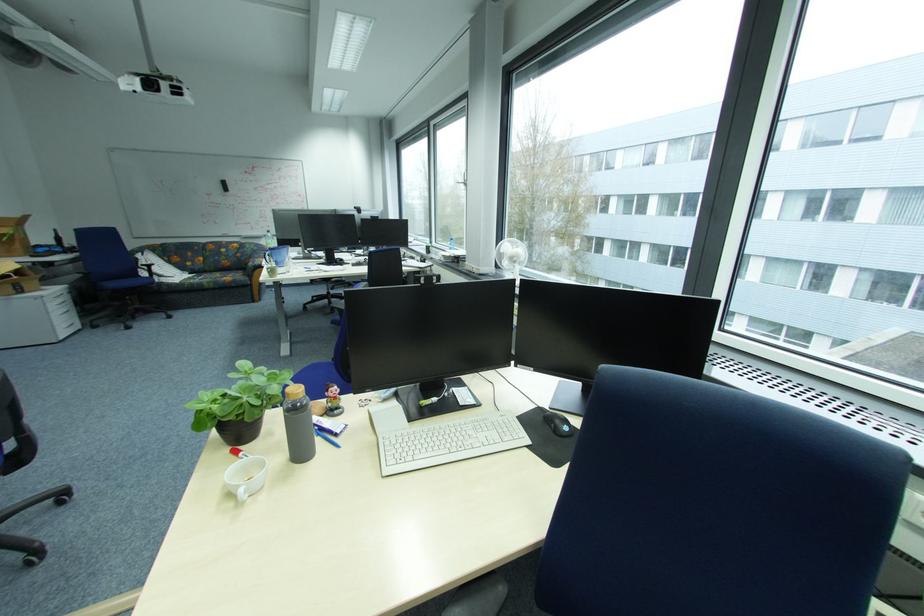
Which object does [447,442] point to?

It corresponds to the computer keyboard in the image.